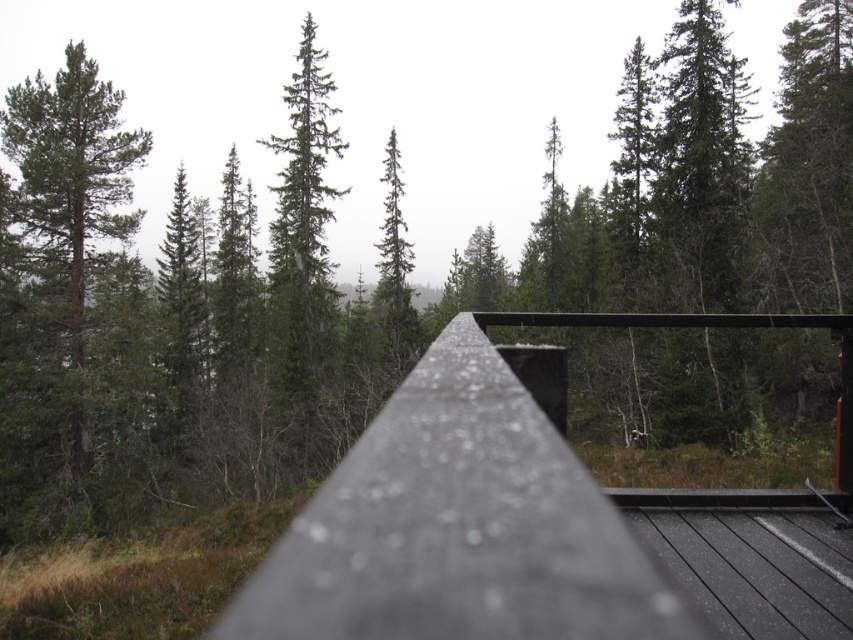
Is point (786, 632) more distant than point (78, 225)?

No, (786, 632) is closer to viewer.

Is the position of smooth black deck at center less distant than that of green matte tree at left?

That is True.

Is point (540, 323) less distant than point (105, 161)?

That is True.

In order to click on smooth black deck at center in this screenshot , I will do `click(540, 522)`.